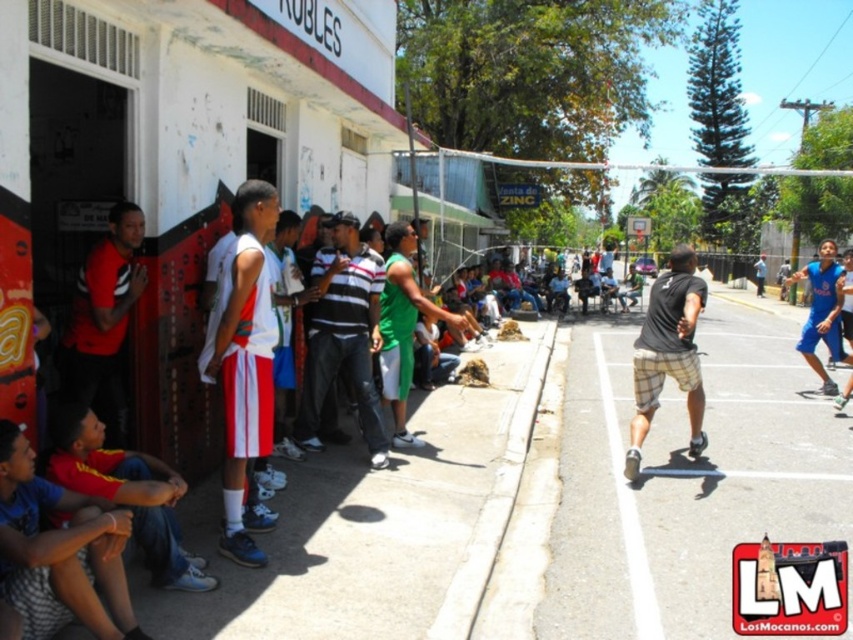
In the scene shown: Can you confirm if matte black shirt at left is positioned below plaid shorts at center?

No.

Does point (111, 444) lie in front of point (631, 516)?

Yes, point (111, 444) is closer to viewer.

I want to click on matte black shirt at left, so click(103, 320).

Identify the location of matte black shirt at left. (103, 320).

Measure the distance from green matte shorts at center to plaid shorts at center.

A distance of 7.73 feet exists between green matte shorts at center and plaid shorts at center.

Can you confirm if green matte shorts at center is smaller than plaid shorts at center?

Indeed, green matte shorts at center has a smaller size compared to plaid shorts at center.

Describe the element at coordinates (402, 326) in the screenshot. The width and height of the screenshot is (853, 640). I see `green matte shorts at center` at that location.

Identify the location of green matte shorts at center. Image resolution: width=853 pixels, height=640 pixels. (402, 326).

Can you confirm if smooth asphalt court at center is positioned above black plaid shorts at center?

No, smooth asphalt court at center is not above black plaid shorts at center.

Find the location of `smooth asphalt court at center`. smooth asphalt court at center is located at coordinates (683, 481).